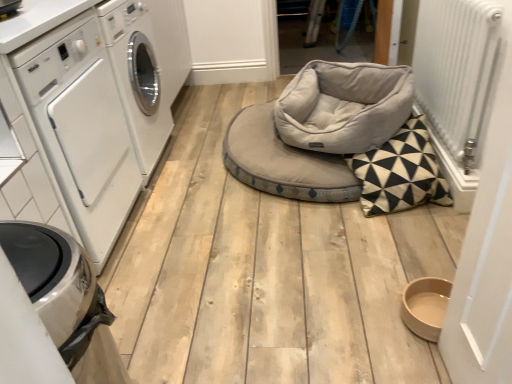
Question: Is soft gray fabric daybed at center thinner than white glossy washing machine at left?

Choices:
 (A) no
 (B) yes

Answer: (A)

Question: From the image's perspective, is soft gray fabric daybed at center on white glossy washing machine at left?

Choices:
 (A) yes
 (B) no

Answer: (A)

Question: From a real-world perspective, is soft gray fabric daybed at center positioned over white glossy washing machine at left based on gravity?

Choices:
 (A) yes
 (B) no

Answer: (B)

Question: Considering the relative sizes of soft gray fabric daybed at center and white glossy washing machine at left in the image provided, is soft gray fabric daybed at center smaller than white glossy washing machine at left?

Choices:
 (A) no
 (B) yes

Answer: (B)

Question: Is soft gray fabric daybed at center to the left of white glossy washing machine at left from the viewer's perspective?

Choices:
 (A) no
 (B) yes

Answer: (A)

Question: Choose the correct answer: Is soft gray fabric daybed at center inside white metallic radiator at right or outside it?

Choices:
 (A) inside
 (B) outside

Answer: (B)

Question: From the image's perspective, is soft gray fabric daybed at center above or below white metallic radiator at right?

Choices:
 (A) above
 (B) below

Answer: (B)

Question: From a real-world perspective, is soft gray fabric daybed at center positioned above or below white metallic radiator at right?

Choices:
 (A) above
 (B) below

Answer: (B)

Question: Considering their positions, is soft gray fabric daybed at center located in front of or behind white metallic radiator at right?

Choices:
 (A) front
 (B) behind

Answer: (B)

Question: In the image, is satin silver trash bin at lower left on the left side or the right side of white metallic radiator at right?

Choices:
 (A) right
 (B) left

Answer: (B)

Question: From a real-world perspective, is satin silver trash bin at lower left physically located above or below white metallic radiator at right?

Choices:
 (A) below
 (B) above

Answer: (A)

Question: In terms of height, does satin silver trash bin at lower left look taller or shorter compared to white metallic radiator at right?

Choices:
 (A) short
 (B) tall

Answer: (B)

Question: Is satin silver trash bin at lower left wider or thinner than white metallic radiator at right?

Choices:
 (A) thin
 (B) wide

Answer: (B)

Question: Does point (333, 66) appear closer or farther from the camera than point (86, 34)?

Choices:
 (A) farther
 (B) closer

Answer: (A)

Question: Considering their positions, is light gray plush bean bag chair at center located in front of or behind white glossy washing machine at left?

Choices:
 (A) behind
 (B) front

Answer: (A)